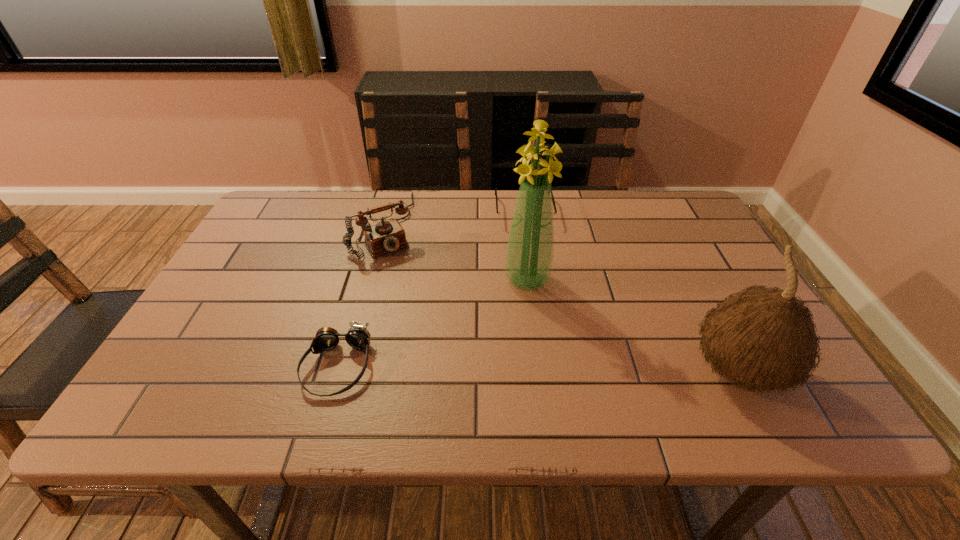
This screenshot has width=960, height=540. In order to click on object situated at the right edge in this screenshot , I will do click(763, 338).

Where is `object that is at the near right corner`? object that is at the near right corner is located at coordinates (763, 338).

In the image, there is a desktop. At what (x,y) coordinates should I click in order to perform the action: click on vacant space at the far edge. Please return your answer as a coordinate pair (x, y). The image size is (960, 540). Looking at the image, I should click on click(x=584, y=196).

At what (x,y) coordinates should I click in order to perform the action: click on free space at the near edge of the desktop. Please return your answer as a coordinate pair (x, y). The width and height of the screenshot is (960, 540). Looking at the image, I should click on (597, 352).

Locate an element on the screen. The width and height of the screenshot is (960, 540). free space at the left edge is located at coordinates (188, 333).

Image resolution: width=960 pixels, height=540 pixels. I want to click on free location at the right edge, so click(x=669, y=252).

Where is `vacant region at the far left corner of the desktop`? The image size is (960, 540). vacant region at the far left corner of the desktop is located at coordinates (278, 218).

In the image, there is a desktop. At what (x,y) coordinates should I click in order to perform the action: click on vacant area at the near left corner. Please return your answer as a coordinate pair (x, y). The height and width of the screenshot is (540, 960). Looking at the image, I should click on (206, 378).

Locate an element on the screen. The height and width of the screenshot is (540, 960). free spot at the far right corner of the desktop is located at coordinates (656, 201).

Find the location of a particular element. This screenshot has height=540, width=960. blank region between the spectacles and the second tallest object is located at coordinates (632, 292).